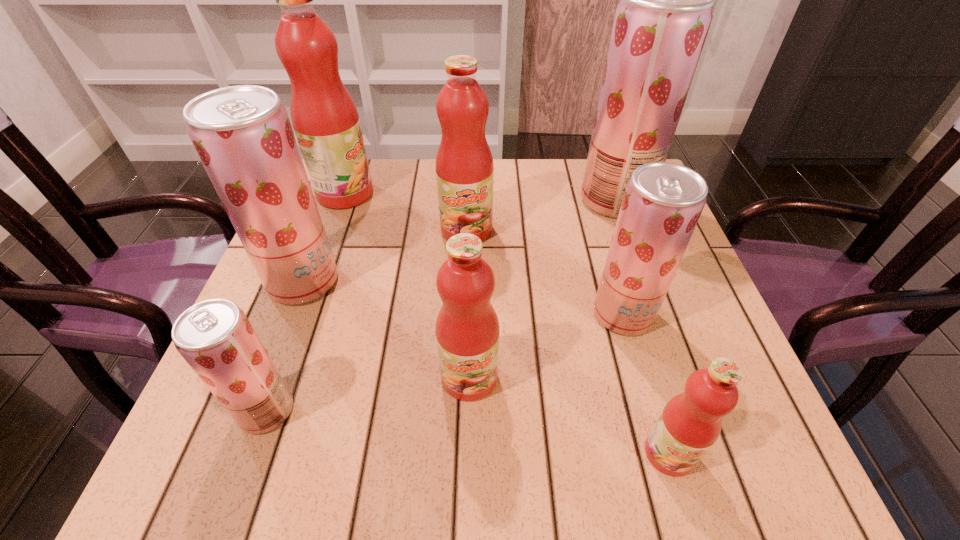
Select which object appears as the third closest to the third smallest strawberry fruit juice. Please provide its 2D coordinates. Your answer should be formatted as a tuple, i.e. [(x, y)], where the tuple contains the x and y coordinates of a point satisfying the conditions above.

[(464, 166)]

The image size is (960, 540). Identify the location of the closest object to the biggest strawberry fruit juice. (464, 166).

The width and height of the screenshot is (960, 540). What are the coordinates of `the second closest fruit juice to the second smallest strawberry fruit juice` in the screenshot? It's located at (467, 328).

Select which fruit juice appears as the sixth closest to the biggest strawberry fruit juice. Please provide its 2D coordinates. Your answer should be formatted as a tuple, i.e. [(x, y)], where the tuple contains the x and y coordinates of a point satisfying the conditions above.

[(242, 134)]

Identify which pink fruit juice is located as the second nearest to the nearest strawberry fruit juice. Please provide its 2D coordinates. Your answer should be formatted as a tuple, i.e. [(x, y)], where the tuple contains the x and y coordinates of a point satisfying the conditions above.

[(464, 166)]

Choose which pink fruit juice is the third nearest neighbor to the second biggest strawberry fruit juice. Please provide its 2D coordinates. Your answer should be formatted as a tuple, i.e. [(x, y)], where the tuple contains the x and y coordinates of a point satisfying the conditions above.

[(467, 328)]

Identify which strawberry fruit juice is the third closest to the second smallest pink fruit juice. Please provide its 2D coordinates. Your answer should be formatted as a tuple, i.e. [(x, y)], where the tuple contains the x and y coordinates of a point satisfying the conditions above.

[(242, 134)]

Image resolution: width=960 pixels, height=540 pixels. I want to click on strawberry fruit juice that stands as the third closest to the second nearest pink fruit juice, so click(242, 134).

This screenshot has width=960, height=540. Identify the location of free space that satisfies the following two spatial constraints: 1. on the front side of the second smallest strawberry fruit juice; 2. on the left side of the third smallest strawberry fruit juice. (291, 314).